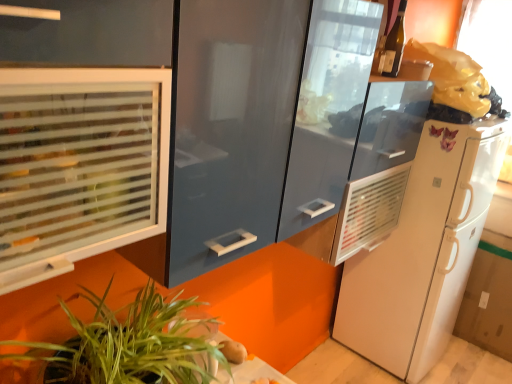
Describe the element at coordinates (127, 344) in the screenshot. I see `green leafy plant at lower left` at that location.

Identify the location of smooth brown potato at lower center. The image size is (512, 384). (233, 351).

Describe the element at coordinates (233, 351) in the screenshot. I see `smooth brown potato at lower center` at that location.

What are the coordinates of `translucent glass wine bottle at upper right` in the screenshot? It's located at (395, 44).

Is smooth brown potato at lower center surrounded by white matte refrigerator at right?

No, smooth brown potato at lower center is located outside of white matte refrigerator at right.

Considering the sizes of white matte refrigerator at right and smooth brown potato at lower center in the image, is white matte refrigerator at right wider or thinner than smooth brown potato at lower center?

white matte refrigerator at right is wider than smooth brown potato at lower center.

Identify the location of refrigerator lying above the smooth brown potato at lower center (from the image's perspective). (423, 251).

Who is taller, white matte refrigerator at right or smooth brown potato at lower center?

white matte refrigerator at right is taller.

Is green leafy plant at lower left directly adjacent to translucent glass wine bottle at upper right?

green leafy plant at lower left and translucent glass wine bottle at upper right are not in contact.

Could you tell me if green leafy plant at lower left is turned towards translucent glass wine bottle at upper right?

No, green leafy plant at lower left is not facing towards translucent glass wine bottle at upper right.

Between green leafy plant at lower left and translucent glass wine bottle at upper right, which one has smaller width?

Thinner between the two is translucent glass wine bottle at upper right.

Considering the relative sizes of green leafy plant at lower left and translucent glass wine bottle at upper right in the image provided, is green leafy plant at lower left smaller than translucent glass wine bottle at upper right?

No, green leafy plant at lower left is not smaller than translucent glass wine bottle at upper right.

Can you confirm if translucent glass wine bottle at upper right is wider than green leafy plant at lower left?

Incorrect, the width of translucent glass wine bottle at upper right does not surpass that of green leafy plant at lower left.

From the image's perspective, is translucent glass wine bottle at upper right above or below green leafy plant at lower left?

From the image's perspective, translucent glass wine bottle at upper right appears above green leafy plant at lower left.

At what (x,y) coordinates should I click in order to perform the action: click on wine bottle that is above the green leafy plant at lower left (from a real-world perspective). Please return your answer as a coordinate pair (x, y). Image resolution: width=512 pixels, height=384 pixels. Looking at the image, I should click on (395, 44).

Which of these two, translucent glass wine bottle at upper right or green leafy plant at lower left, is bigger?

green leafy plant at lower left.

Is frosted glass window at left in contact with green leafy plant at lower left?

No, frosted glass window at left is not making contact with green leafy plant at lower left.

In the scene shown: Based on their sizes in the image, would you say frosted glass window at left is bigger or smaller than green leafy plant at lower left?

In the image, frosted glass window at left appears to be smaller than green leafy plant at lower left.

From the image's perspective, is frosted glass window at left positioned above or below green leafy plant at lower left?

frosted glass window at left is above green leafy plant at lower left.

Which is more to the left, frosted glass window at left or green leafy plant at lower left?

frosted glass window at left.

Is smooth brown potato at lower center positioned before frosted glass window at left?

That is False.

From the image's perspective, is smooth brown potato at lower center located above or below frosted glass window at left?

smooth brown potato at lower center is below frosted glass window at left.

Based on the photo, from a real-world perspective, is smooth brown potato at lower center above or below frosted glass window at left?

smooth brown potato at lower center is below frosted glass window at left.

Which is less distant, (233,360) or (15,190)?

The point (15,190) is closer to the camera.

Is the surface of green leafy plant at lower left in direct contact with frosted glass window at left?

green leafy plant at lower left and frosted glass window at left are clearly separated.

Do you think green leafy plant at lower left is within frosted glass window at left, or outside of it?

green leafy plant at lower left is not enclosed by frosted glass window at left.

Does green leafy plant at lower left have a larger size compared to frosted glass window at left?

Indeed, green leafy plant at lower left has a larger size compared to frosted glass window at left.

Is green leafy plant at lower left taller or shorter than white matte refrigerator at right?

green leafy plant at lower left is shorter than white matte refrigerator at right.

Which of these two, green leafy plant at lower left or white matte refrigerator at right, is bigger?

white matte refrigerator at right is bigger.

Is green leafy plant at lower left positioned behind white matte refrigerator at right?

No, green leafy plant at lower left is closer to the camera.

Locate an element on the screen. refrigerator above the smooth brown potato at lower center (from the image's perspective) is located at coordinates (423, 251).

Where is `wine bottle on the right of green leafy plant at lower left`? wine bottle on the right of green leafy plant at lower left is located at coordinates (395, 44).

Looking at the image, which one is located closer to frosted glass window at left, smooth brown potato at lower center or translucent glass wine bottle at upper right?

smooth brown potato at lower center.

Which object lies nearer to the anchor point white matte refrigerator at right, translucent glass wine bottle at upper right or green leafy plant at lower left?

Based on the image, translucent glass wine bottle at upper right appears to be nearer to white matte refrigerator at right.

Which object lies nearer to the anchor point white matte refrigerator at right, green leafy plant at lower left or smooth brown potato at lower center?

smooth brown potato at lower center is positioned closer to the anchor white matte refrigerator at right.

Based on their spatial positions, is frosted glass window at left or translucent glass wine bottle at upper right closer to smooth brown potato at lower center?

frosted glass window at left lies closer to smooth brown potato at lower center than the other object.

Looking at the image, which one is located further to translucent glass wine bottle at upper right, green leafy plant at lower left or frosted glass window at left?

The object further to translucent glass wine bottle at upper right is green leafy plant at lower left.

When comparing their distances from frosted glass window at left, does green leafy plant at lower left or translucent glass wine bottle at upper right seem closer?

Based on the image, green leafy plant at lower left appears to be nearer to frosted glass window at left.

Estimate the real-world distances between objects in this image. Which object is closer to frosted glass window at left, green leafy plant at lower left or white matte refrigerator at right?

green leafy plant at lower left is closer to frosted glass window at left.

Estimate the real-world distances between objects in this image. Which object is closer to smooth brown potato at lower center, green leafy plant at lower left or white matte refrigerator at right?

Based on the image, green leafy plant at lower left appears to be nearer to smooth brown potato at lower center.

I want to click on refrigerator between translucent glass wine bottle at upper right and green leafy plant at lower left from top to bottom, so [423, 251].

The image size is (512, 384). What are the coordinates of `houseplant between translucent glass wine bottle at upper right and smooth brown potato at lower center in the vertical direction` in the screenshot? It's located at (127, 344).

In order to click on houseplant between frosted glass window at left and white matte refrigerator at right from left to right in this screenshot , I will do `click(127, 344)`.

Find the location of a particular element. Image resolution: width=512 pixels, height=384 pixels. houseplant between frosted glass window at left and smooth brown potato at lower center in the front-back direction is located at coordinates (127, 344).